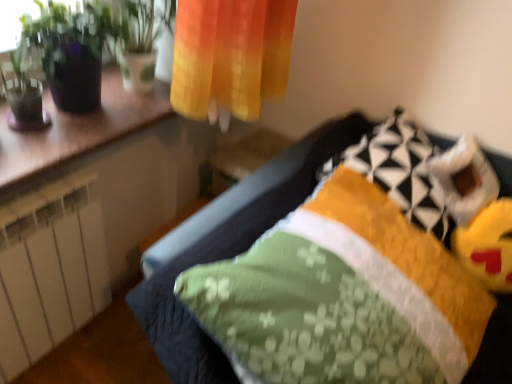
Question: From a real-world perspective, is green fabric pillow at center, the 1th pillow positioned from the bottom, positioned under yellow quilted pillow at upper right, the first pillow from the top, based on gravity?

Choices:
 (A) yes
 (B) no

Answer: (A)

Question: Considering the relative positions of green fabric pillow at center, which is the second pillow from top to bottom, and yellow quilted pillow at upper right, arranged as the 2th pillow when ordered from the bottom, in the image provided, is green fabric pillow at center, which is the second pillow from top to bottom, to the left of yellow quilted pillow at upper right, arranged as the 2th pillow when ordered from the bottom, from the viewer's perspective?

Choices:
 (A) no
 (B) yes

Answer: (B)

Question: Is green fabric pillow at center, the 1th pillow positioned from the bottom, wider than yellow quilted pillow at upper right, arranged as the 2th pillow when ordered from the bottom?

Choices:
 (A) yes
 (B) no

Answer: (A)

Question: Considering the relative sizes of green fabric pillow at center, which is the second pillow from top to bottom, and yellow quilted pillow at upper right, the first pillow from the top, in the image provided, is green fabric pillow at center, which is the second pillow from top to bottom, shorter than yellow quilted pillow at upper right, the first pillow from the top,?

Choices:
 (A) yes
 (B) no

Answer: (B)

Question: Considering the relative sizes of green fabric pillow at center, the 1th pillow positioned from the bottom, and yellow quilted pillow at upper right, the first pillow from the top, in the image provided, is green fabric pillow at center, the 1th pillow positioned from the bottom, smaller than yellow quilted pillow at upper right, the first pillow from the top,?

Choices:
 (A) yes
 (B) no

Answer: (B)

Question: Does point (71, 76) appear closer or farther from the camera than point (471, 230)?

Choices:
 (A) closer
 (B) farther

Answer: (A)

Question: In the image, is green glossy plant at upper left on the left side or the right side of yellow plush toy at lower right?

Choices:
 (A) right
 (B) left

Answer: (B)

Question: From the image's perspective, is green glossy plant at upper left located above or below yellow plush toy at lower right?

Choices:
 (A) below
 (B) above

Answer: (B)

Question: Is green glossy plant at upper left wider or thinner than yellow plush toy at lower right?

Choices:
 (A) thin
 (B) wide

Answer: (B)

Question: Would you say yellow plush toy at lower right is inside or outside green glossy plant at upper left?

Choices:
 (A) inside
 (B) outside

Answer: (B)

Question: Is point (474, 231) closer or farther from the camera than point (73, 49)?

Choices:
 (A) farther
 (B) closer

Answer: (A)

Question: In terms of width, does yellow plush toy at lower right look wider or thinner when compared to green glossy plant at upper left?

Choices:
 (A) wide
 (B) thin

Answer: (B)

Question: In terms of height, does yellow plush toy at lower right look taller or shorter compared to green glossy plant at upper left?

Choices:
 (A) short
 (B) tall

Answer: (A)

Question: Considering the positions of green glossy plant at upper left and green fabric pillow at center, which is the second pillow from top to bottom, in the image, is green glossy plant at upper left wider or thinner than green fabric pillow at center, which is the second pillow from top to bottom,?

Choices:
 (A) thin
 (B) wide

Answer: (A)

Question: Is green glossy plant at upper left taller or shorter than green fabric pillow at center, the 1th pillow positioned from the bottom?

Choices:
 (A) tall
 (B) short

Answer: (B)